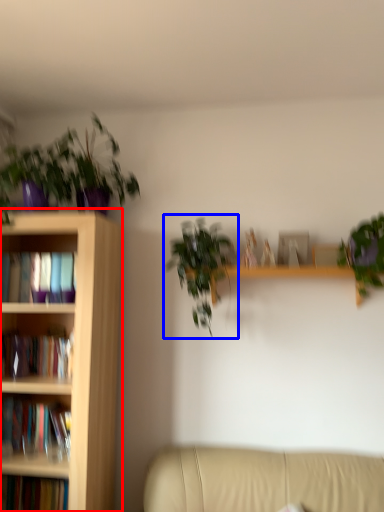
Question: Which of the following is the farthest to the observer, bookcase (highlighted by a red box) or houseplant (highlighted by a blue box)?

Choices:
 (A) bookcase
 (B) houseplant

Answer: (B)